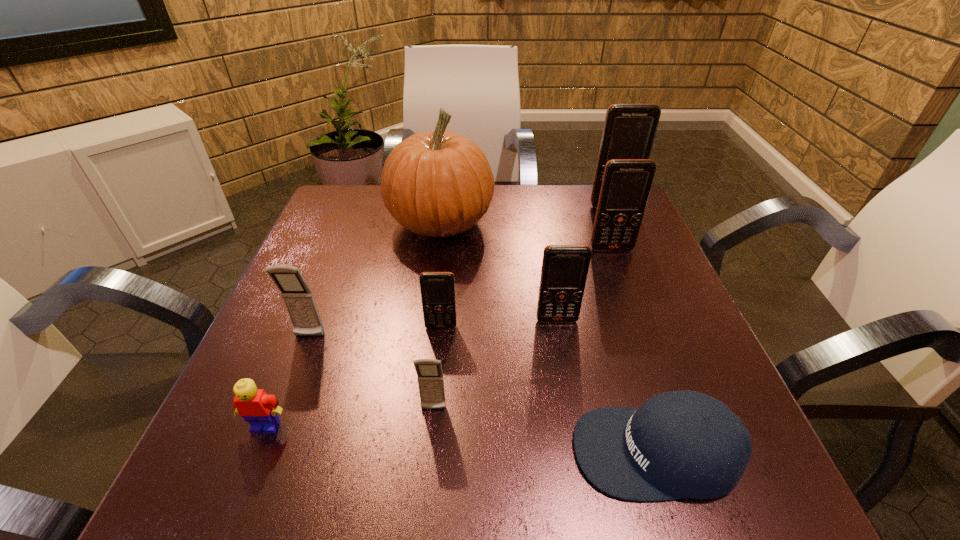
The width and height of the screenshot is (960, 540). I want to click on the smaller gray cellular telephone, so click(x=430, y=378).

I want to click on the nearer gray cellular telephone, so click(x=430, y=378).

Find the location of `Lego`. Lego is located at coordinates (256, 407).

The width and height of the screenshot is (960, 540). I want to click on the shortest object, so click(x=678, y=444).

Locate an element on the screen. This screenshot has width=960, height=540. baseball cap is located at coordinates (678, 444).

Find the location of `vacant area situated 0.290m on the stem of the pumpkin`. vacant area situated 0.290m on the stem of the pumpkin is located at coordinates (609, 222).

The width and height of the screenshot is (960, 540). I want to click on free region located on the screen of the tallest cellular telephone, so click(648, 290).

Where is `vacant area situated on the screen of the seventh shortest object`? vacant area situated on the screen of the seventh shortest object is located at coordinates (651, 355).

Where is `free region located on the front-facing side of the bigger gray cellular telephone`? The height and width of the screenshot is (540, 960). free region located on the front-facing side of the bigger gray cellular telephone is located at coordinates (282, 408).

Locate an element on the screen. Image resolution: width=960 pixels, height=540 pixels. free space located 0.250m on the screen of the third biggest orange cellular telephone is located at coordinates (580, 447).